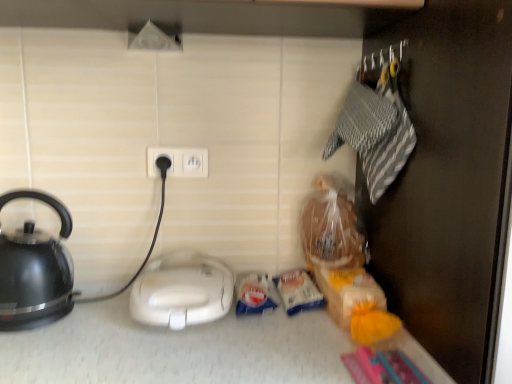
Question: From the image's perspective, is white plastic socket at center beneath white plastic sandwich maker at center?

Choices:
 (A) yes
 (B) no

Answer: (B)

Question: Is white plastic socket at center far away from white plastic sandwich maker at center?

Choices:
 (A) yes
 (B) no

Answer: (B)

Question: Is white plastic socket at center closer to the viewer compared to white plastic sandwich maker at center?

Choices:
 (A) no
 (B) yes

Answer: (A)

Question: Does white plastic socket at center lie behind white plastic sandwich maker at center?

Choices:
 (A) no
 (B) yes

Answer: (B)

Question: Is white plastic socket at center shorter than white plastic sandwich maker at center?

Choices:
 (A) yes
 (B) no

Answer: (A)

Question: From a real-world perspective, is white plastic socket at center beneath white plastic sandwich maker at center?

Choices:
 (A) no
 (B) yes

Answer: (A)

Question: From a real-world perspective, does white plastic sandwich maker at center stand above white plastic socket at center?

Choices:
 (A) no
 (B) yes

Answer: (A)

Question: Can you confirm if white plastic sandwich maker at center is wider than white plastic socket at center?

Choices:
 (A) yes
 (B) no

Answer: (A)

Question: Is white plastic sandwich maker at center bigger than white plastic socket at center?

Choices:
 (A) no
 (B) yes

Answer: (B)

Question: Does white plastic sandwich maker at center appear on the right side of white plastic socket at center?

Choices:
 (A) yes
 (B) no

Answer: (A)

Question: Is white plastic sandwich maker at center looking in the opposite direction of white plastic socket at center?

Choices:
 (A) no
 (B) yes

Answer: (A)

Question: Could white plastic socket at center be considered to be inside white plastic sandwich maker at center?

Choices:
 (A) no
 (B) yes

Answer: (A)

Question: Does black glossy kettle at left come in front of white plastic sandwich maker at center?

Choices:
 (A) yes
 (B) no

Answer: (A)